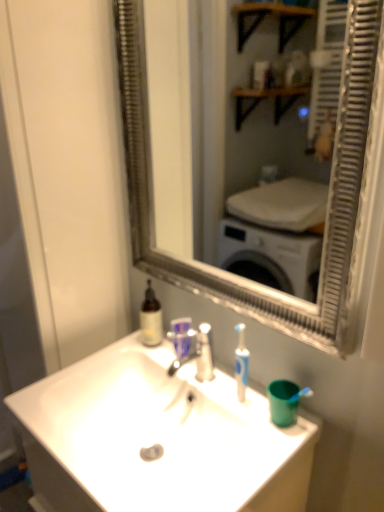
Identify the location of vacant space in front of translucent plastic mouthwash at center. The image size is (384, 512). (206, 386).